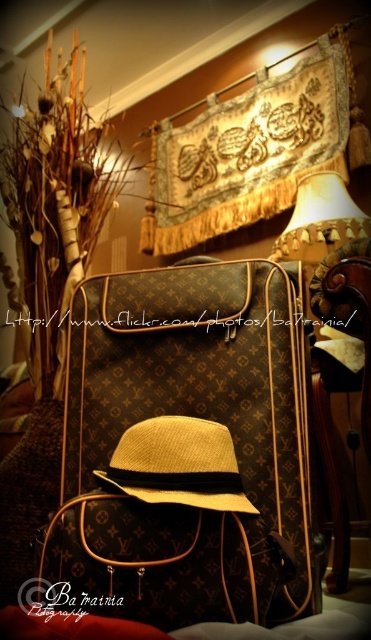
You are planning to place a rectangular box that is 1.2 meters wide on the floor between the brown leather chair at center and the straw fedora at center. Based on the scene description, will the box fit between them horizontally?

The brown leather chair at center is narrower than the straw fedora at center. Since the box is 1.2 meters wide, it depends on the actual width of the space between them. However, since the chair is narrower than the hat, the space between them might be sufficient, but without exact measurements, we cannot confirm.

You are organizing a display in a Louis Vuitton store and need to place a new accessory between the brown monogrammed suitcase at center and the straw fedora at center. According to the current arrangement, which object should the new accessory be placed to the right of?

The new accessory should be placed to the right of the brown monogrammed suitcase at center because the straw fedora at center is positioned to its right side.

You are organizing a display and need to place a 4.5 inch wide decorative item between the brown monogrammed suitcase at center and the straw fedora at center. Can the item fit in the space between them?

The space between the brown monogrammed suitcase at center and the straw fedora at center is only 3.94 inches, which is narrower than the 4.5 inch wide item. The item cannot fit in the space between them.